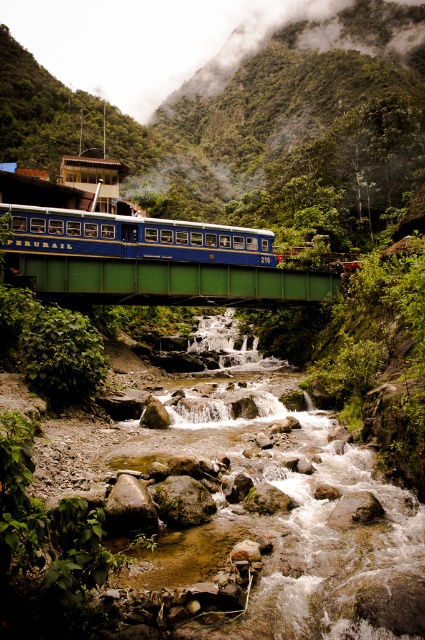
Question: From the image, what is the correct spatial relationship of green painted metal bridge at center in relation to blue polished wood passenger train at center?

Choices:
 (A) left
 (B) right

Answer: (B)

Question: Which object appears closest to the camera in this image?

Choices:
 (A) blue polished wood passenger train at center
 (B) green painted metal bridge at center

Answer: (B)

Question: From the image, what is the correct spatial relationship of green painted metal bridge at center in relation to blue polished wood passenger train at center?

Choices:
 (A) above
 (B) below

Answer: (B)

Question: Does green painted metal bridge at center lie behind blue polished wood passenger train at center?

Choices:
 (A) no
 (B) yes

Answer: (A)

Question: Which object is farther from the camera taking this photo?

Choices:
 (A) blue polished wood passenger train at center
 (B) green painted metal bridge at center

Answer: (A)

Question: Which object appears farthest from the camera in this image?

Choices:
 (A) blue polished wood passenger train at center
 (B) green painted metal bridge at center

Answer: (A)